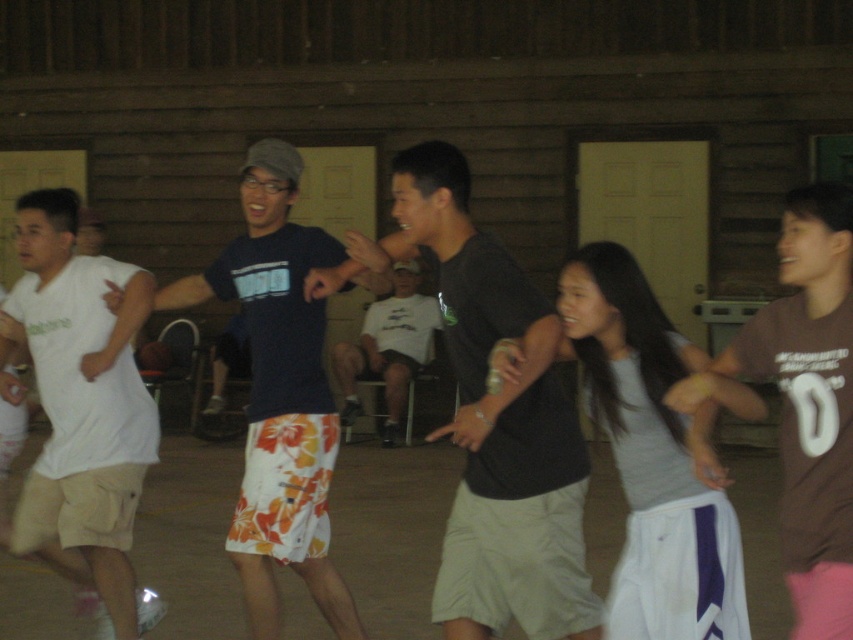
Question: Among these objects, which one is farthest from the camera?

Choices:
 (A) white cotton shirt at center
 (B) dark gray t-shirt at center
 (C) floral shorts at center

Answer: (A)

Question: Which of the following is the farthest from the observer?

Choices:
 (A) floral shorts at center
 (B) white cotton shirt at center
 (C) white cotton t-shirt at left
 (D) dark gray t-shirt at center

Answer: (B)

Question: Does white cotton t-shirt at left lie behind brown cotton t-shirt at right?

Choices:
 (A) yes
 (B) no

Answer: (A)

Question: Does dark gray t-shirt at center have a smaller size compared to brown cotton t-shirt at right?

Choices:
 (A) no
 (B) yes

Answer: (A)

Question: Can you confirm if floral shorts at center is positioned below white cotton t-shirt at left?

Choices:
 (A) no
 (B) yes

Answer: (A)

Question: Which point is closer to the camera taking this photo?

Choices:
 (A) (849, 378)
 (B) (451, 252)

Answer: (A)